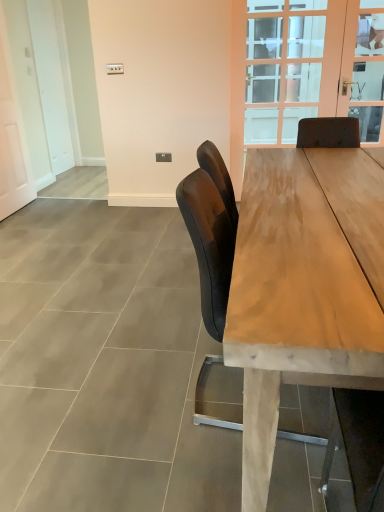
Where is `blank space situated above wooden table at center (from a real-world perspective)`? This screenshot has height=512, width=384. blank space situated above wooden table at center (from a real-world perspective) is located at coordinates point(329,186).